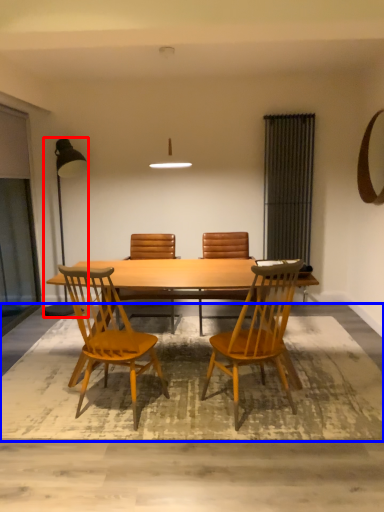
Question: Among these objects, which one is nearest to the camera, lamp (highlighted by a red box) or mat (highlighted by a blue box)?

Choices:
 (A) lamp
 (B) mat

Answer: (B)